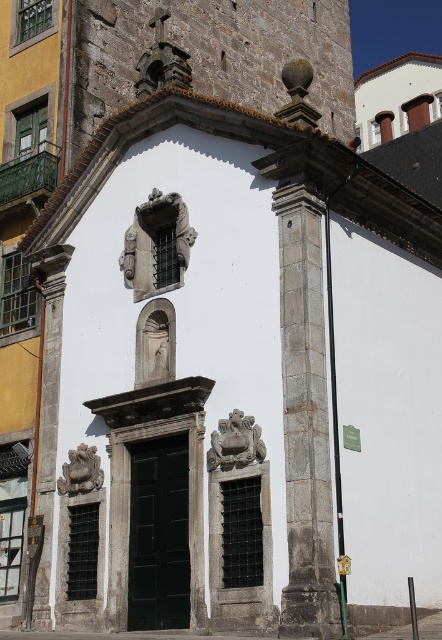
Can you confirm if smooth stone column at left is wider than carved stone statue at center?

Yes.

Is smooth stone column at left bigger than carved stone statue at center?

Correct, smooth stone column at left is larger in size than carved stone statue at center.

Measure the distance between point (71,250) and camera.

Point (71,250) and camera are 48.67 meters apart.

You are a GUI agent. You are given a task and a screenshot of the screen. Output one action in this format:
    pyautogui.click(x=<x>, y=<y>)
    Task: Click on the smooth stone column at left
    Image resolution: width=442 pixels, height=640 pixels.
    Given the screenshot: What is the action you would take?
    pyautogui.click(x=48, y=364)

Based on the photo, can you confirm if carved stone statue at center is shorter than stone carved lion at lower left?

Incorrect, carved stone statue at center's height does not fall short of stone carved lion at lower left's.

This screenshot has height=640, width=442. In order to click on carved stone statue at center in this screenshot , I will do `click(236, 442)`.

Is gray stone column at center wider than stone carved lion at lower left?

No.

Who is positioned more to the right, gray stone column at center or stone carved lion at lower left?

gray stone column at center is more to the right.

Where is `gray stone column at center`? gray stone column at center is located at coordinates (304, 417).

This screenshot has height=640, width=442. Identify the location of gray stone column at center. (304, 417).